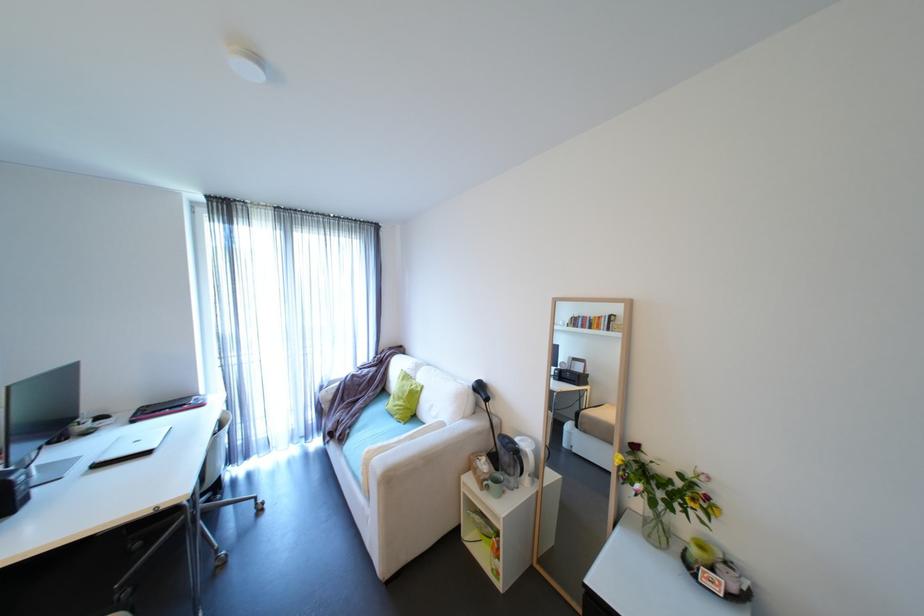
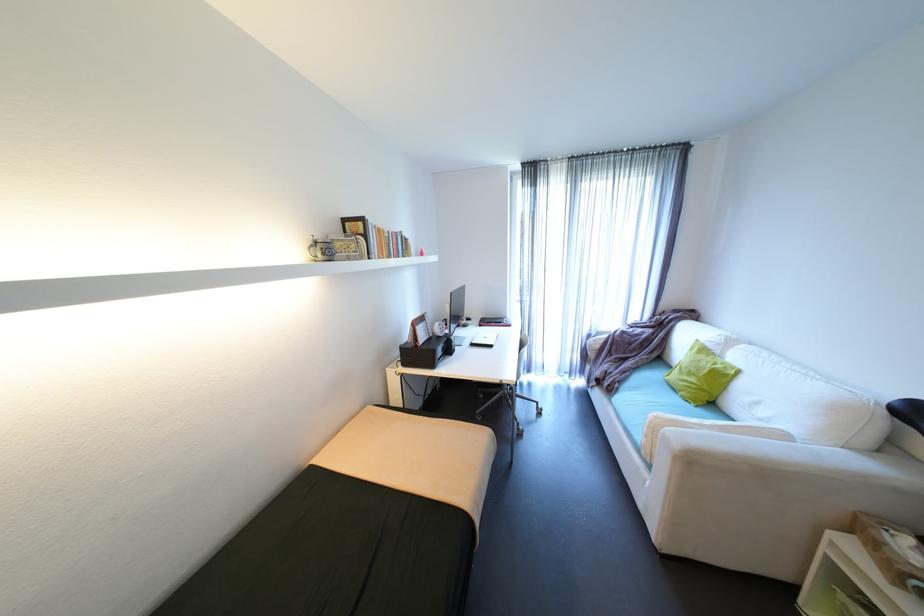
Question: The camera is either moving clockwise (left) or counter-clockwise (right) around the object. The first image is from the beginning of the video and the second image is from the end. Is the camera moving left or right when shooting the video?

Choices:
 (A) Left
 (B) Right

Answer: (B)